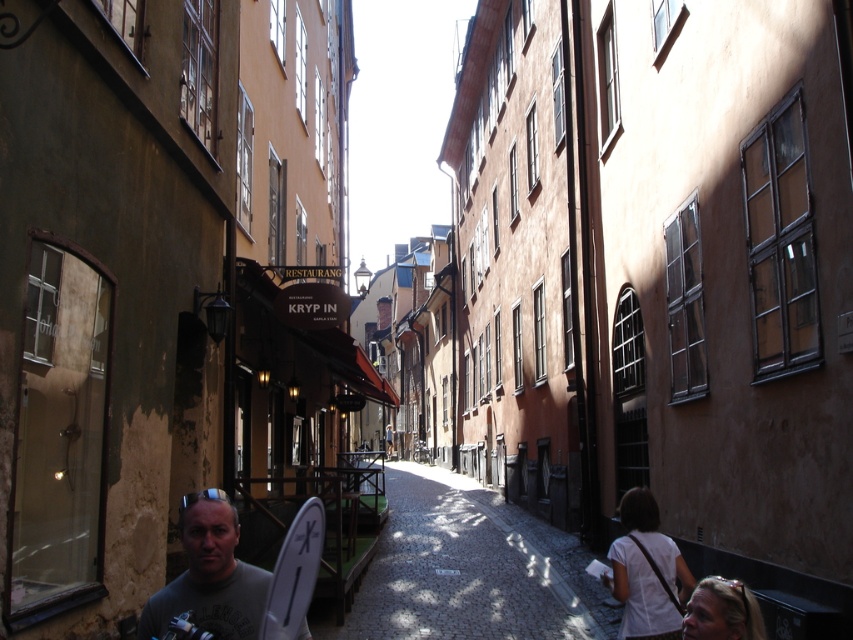
Question: Is cobblestone street at center thinner than gray matte t-shirt at lower center?

Choices:
 (A) no
 (B) yes

Answer: (A)

Question: Among these objects, which one is nearest to the camera?

Choices:
 (A) cobblestone street at center
 (B) gray matte t-shirt at lower center

Answer: (B)

Question: Is cobblestone street at center bigger than gray matte t-shirt at lower center?

Choices:
 (A) yes
 (B) no

Answer: (A)

Question: Is cobblestone street at center thinner than gray matte t-shirt at lower center?

Choices:
 (A) yes
 (B) no

Answer: (B)

Question: Which object appears farthest from the camera in this image?

Choices:
 (A) cobblestone street at center
 (B) gray matte t-shirt at lower center

Answer: (A)